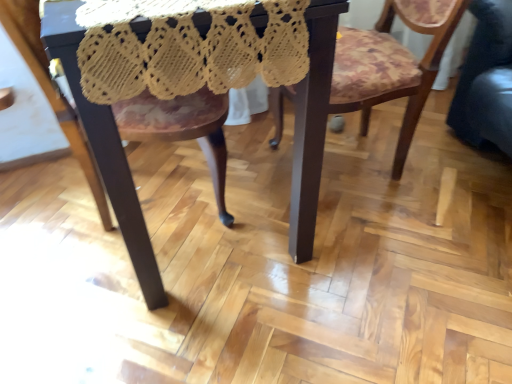
Locate an element on the screen. Image resolution: width=512 pixels, height=384 pixels. wooden chair at center, acting as the second chair starting from the right is located at coordinates (185, 134).

Which is more to the right, dark brown polished wood table at center or wooden floral-patterned chair at center, acting as the second chair starting from the left?

wooden floral-patterned chair at center, acting as the second chair starting from the left, is more to the right.

Considering the points (62, 8) and (419, 82), which point is behind, point (62, 8) or point (419, 82)?

Point (419, 82)

Does dark brown polished wood table at center have a smaller size compared to wooden floral-patterned chair at center, the first chair viewed from the right?

Actually, dark brown polished wood table at center might be larger than wooden floral-patterned chair at center, the first chair viewed from the right.

From a real-world perspective, is wooden floral-patterned chair at center, acting as the second chair starting from the left, on top of yellow crochet lace at center?

No, from a real-world perspective, wooden floral-patterned chair at center, acting as the second chair starting from the left, is not over yellow crochet lace at center

Which of these two, wooden floral-patterned chair at center, the first chair viewed from the right, or yellow crochet lace at center, stands shorter?

yellow crochet lace at center.

Is wooden floral-patterned chair at center, acting as the second chair starting from the left, wider or thinner than yellow crochet lace at center?

Clearly, wooden floral-patterned chair at center, acting as the second chair starting from the left, has less width compared to yellow crochet lace at center.

Is wooden floral-patterned chair at center, the first chair viewed from the right, facing towards yellow crochet lace at center?

Yes, wooden floral-patterned chair at center, the first chair viewed from the right, faces towards yellow crochet lace at center.

Which is in front, point (428, 34) or point (27, 38)?

Positioned in front is point (27, 38).

Does wooden floral-patterned chair at center, acting as the second chair starting from the left, have a greater width compared to wooden chair at center, acting as the second chair starting from the right?

No, wooden floral-patterned chair at center, acting as the second chair starting from the left, is not wider than wooden chair at center, acting as the second chair starting from the right.

Is wooden floral-patterned chair at center, acting as the second chair starting from the left, placed right next to wooden chair at center, acting as the second chair starting from the right?

No, wooden floral-patterned chair at center, acting as the second chair starting from the left, is not touching wooden chair at center, acting as the second chair starting from the right.

Is dark brown polished wood table at center positioned before yellow crochet lace at center?

No, dark brown polished wood table at center is behind yellow crochet lace at center.

From the image's perspective, is dark brown polished wood table at center under yellow crochet lace at center?

Yes.

Is dark brown polished wood table at center located outside yellow crochet lace at center?

That's correct, dark brown polished wood table at center is outside of yellow crochet lace at center.

Measure the distance between wooden chair at center, which is counted as the first chair, starting from the left, and dark brown polished wood table at center.

The distance of wooden chair at center, which is counted as the first chair, starting from the left, from dark brown polished wood table at center is 10.97 inches.

Between wooden chair at center, acting as the second chair starting from the right, and dark brown polished wood table at center, which one has smaller size?

With smaller size is wooden chair at center, acting as the second chair starting from the right.

From a real-world perspective, is wooden chair at center, acting as the second chair starting from the right, physically below dark brown polished wood table at center?

Yes, from a real-world perspective, wooden chair at center, acting as the second chair starting from the right, is below dark brown polished wood table at center.

Is wooden chair at center, which is counted as the first chair, starting from the left, facing away from dark brown polished wood table at center?

That's right, wooden chair at center, which is counted as the first chair, starting from the left, is facing away from dark brown polished wood table at center.

From a real-world perspective, who is located lower, wooden floral-patterned chair at center, acting as the second chair starting from the left, or dark brown polished wood table at center?

wooden floral-patterned chair at center, acting as the second chair starting from the left, from a real-world perspective.

Does wooden floral-patterned chair at center, acting as the second chair starting from the left, have a smaller size compared to dark brown polished wood table at center?

Indeed, wooden floral-patterned chair at center, acting as the second chair starting from the left, has a smaller size compared to dark brown polished wood table at center.

From the image's perspective, which object appears higher, wooden floral-patterned chair at center, acting as the second chair starting from the left, or dark brown polished wood table at center?

wooden floral-patterned chair at center, acting as the second chair starting from the left, from the image's perspective.

Is wooden floral-patterned chair at center, acting as the second chair starting from the left, not near dark brown polished wood table at center?

No, wooden floral-patterned chair at center, acting as the second chair starting from the left, is not far away from dark brown polished wood table at center.

Can dark brown polished wood table at center be found inside yellow crochet lace at center?

No, dark brown polished wood table at center is located outside of yellow crochet lace at center.

Between yellow crochet lace at center and dark brown polished wood table at center, which one has larger size?

Bigger between the two is dark brown polished wood table at center.

From a real-world perspective, does yellow crochet lace at center stand above dark brown polished wood table at center?

Correct, in the physical world, yellow crochet lace at center is higher than dark brown polished wood table at center.

The image size is (512, 384). What are the coordinates of `chair that is the 2nd object located behind the dark brown polished wood table at center` in the screenshot? It's located at (392, 65).

Find the location of a particular element. The height and width of the screenshot is (384, 512). lace dress that appears above the wooden floral-patterned chair at center, the first chair viewed from the right (from a real-world perspective) is located at coordinates (188, 48).

Estimate the real-world distances between objects in this image. Which object is closer to yellow crochet lace at center, dark brown polished wood table at center or wooden floral-patterned chair at center, acting as the second chair starting from the left?

The object closer to yellow crochet lace at center is dark brown polished wood table at center.

Looking at the image, which one is located closer to wooden chair at center, which is counted as the first chair, starting from the left, yellow crochet lace at center or dark brown polished wood table at center?

dark brown polished wood table at center.

Looking at this image, when comparing their distances from dark brown polished wood table at center, does wooden chair at center, which is counted as the first chair, starting from the left, or wooden floral-patterned chair at center, acting as the second chair starting from the left, seem further?

wooden floral-patterned chair at center, acting as the second chair starting from the left, is further to dark brown polished wood table at center.

Based on their spatial positions, is dark brown polished wood table at center or wooden chair at center, acting as the second chair starting from the right, further from yellow crochet lace at center?

The object further to yellow crochet lace at center is wooden chair at center, acting as the second chair starting from the right.

Which object lies nearer to the anchor point wooden floral-patterned chair at center, the first chair viewed from the right, wooden chair at center, acting as the second chair starting from the right, or dark brown polished wood table at center?

dark brown polished wood table at center is closer to wooden floral-patterned chair at center, the first chair viewed from the right.

Consider the image. Based on their spatial positions, is wooden floral-patterned chair at center, the first chair viewed from the right, or yellow crochet lace at center further from wooden chair at center, which is counted as the first chair, starting from the left?

wooden floral-patterned chair at center, the first chair viewed from the right, lies further to wooden chair at center, which is counted as the first chair, starting from the left, than the other object.

Based on their spatial positions, is yellow crochet lace at center or wooden chair at center, which is counted as the first chair, starting from the left, closer to dark brown polished wood table at center?

Among the two, yellow crochet lace at center is located nearer to dark brown polished wood table at center.

Which object lies nearer to the anchor point wooden floral-patterned chair at center, acting as the second chair starting from the left, dark brown polished wood table at center or wooden chair at center, acting as the second chair starting from the right?

Based on the image, dark brown polished wood table at center appears to be nearer to wooden floral-patterned chair at center, acting as the second chair starting from the left.

Identify the location of table located between yellow crochet lace at center and wooden floral-patterned chair at center, acting as the second chair starting from the left, in the left-right direction. The width and height of the screenshot is (512, 384). (105, 151).

Where is `table positioned between yellow crochet lace at center and wooden chair at center, which is counted as the first chair, starting from the left, from near to far`? The width and height of the screenshot is (512, 384). table positioned between yellow crochet lace at center and wooden chair at center, which is counted as the first chair, starting from the left, from near to far is located at coordinates (105, 151).

Locate an element on the screen. table situated between wooden chair at center, which is counted as the first chair, starting from the left, and wooden floral-patterned chair at center, the first chair viewed from the right, from left to right is located at coordinates (105, 151).

The width and height of the screenshot is (512, 384). I want to click on lace dress between wooden chair at center, which is counted as the first chair, starting from the left, and wooden floral-patterned chair at center, the first chair viewed from the right, in the horizontal direction, so click(x=188, y=48).